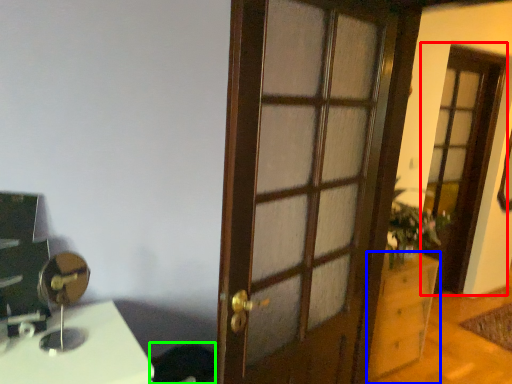
Question: Which object is positioned closest to screen door (highlighted by a red box)? Select from cabinetry (highlighted by a blue box) and swivel chair (highlighted by a green box).

Choices:
 (A) cabinetry
 (B) swivel chair

Answer: (A)